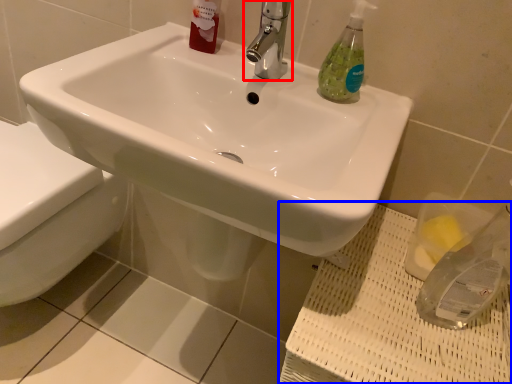
Question: Which of the following is the farthest to the observer, tap (highlighted by a red box) or porcelain (highlighted by a blue box)?

Choices:
 (A) tap
 (B) porcelain

Answer: (A)